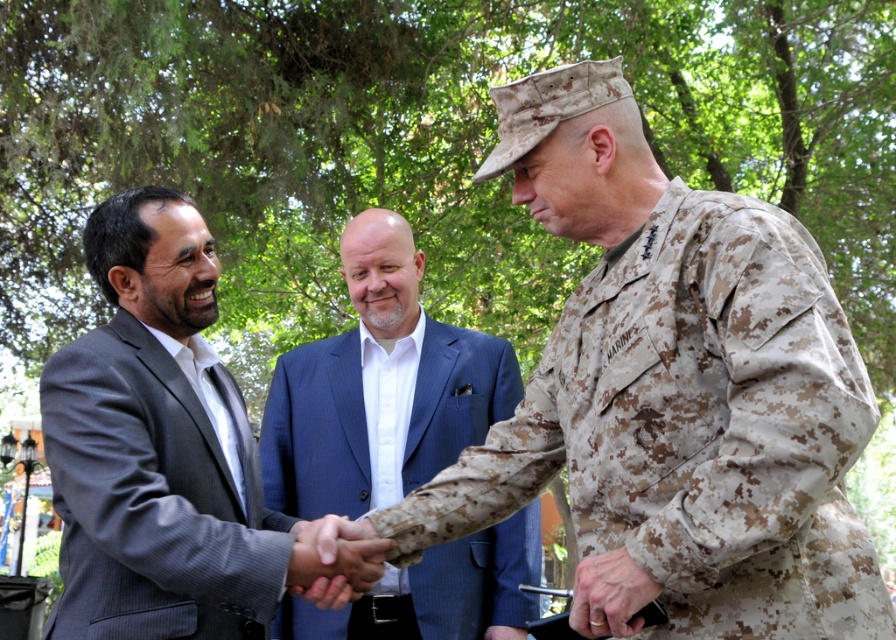
Question: In this image, where is camouflage uniform at center located relative to blue suit at center?

Choices:
 (A) left
 (B) right

Answer: (B)

Question: Among these points, which one is farthest from the camera?

Choices:
 (A) (591, 580)
 (B) (207, 298)

Answer: (B)

Question: Which object is positioned closest to the gray suit at left?

Choices:
 (A) blue suit at center
 (B) camouflage uniform at center
 (C) smooth skin handshake at center

Answer: (C)

Question: Is camouflage uniform at center below blue suit at center?

Choices:
 (A) no
 (B) yes

Answer: (B)

Question: Does camouflage uniform at center lie in front of blue suit at center?

Choices:
 (A) yes
 (B) no

Answer: (A)

Question: Which of the following is the closest to the observer?

Choices:
 (A) camouflage uniform at center
 (B) gray suit at left

Answer: (A)